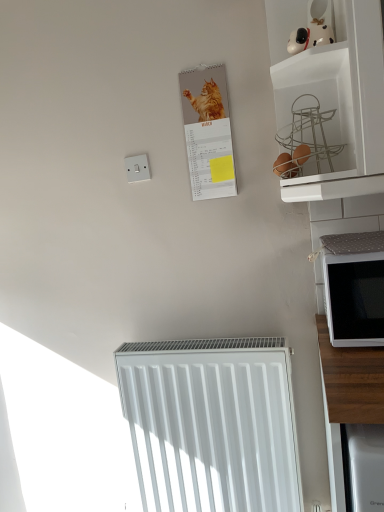
Where is `matte paper calendar at upper center`? matte paper calendar at upper center is located at coordinates (208, 132).

Where is `matte paper calendar at upper center`? This screenshot has height=512, width=384. matte paper calendar at upper center is located at coordinates (208, 132).

Is white matte wire basket at upper right smaller than matte paper calendar at upper center?

Actually, white matte wire basket at upper right might be larger than matte paper calendar at upper center.

Locate an element on the screen. Image resolution: width=384 pixels, height=512 pixels. bulletin board lying below the white matte wire basket at upper right (from the image's perspective) is located at coordinates (208, 132).

Can you tell me how much white matte wire basket at upper right and matte paper calendar at upper center differ in facing direction?

0.103 degrees separate the facing orientations of white matte wire basket at upper right and matte paper calendar at upper center.

Looking at this image, considering the relative positions of white matte wire basket at upper right and matte paper calendar at upper center in the image provided, is white matte wire basket at upper right to the left or to the right of matte paper calendar at upper center?

Based on their positions, white matte wire basket at upper right is located to the right of matte paper calendar at upper center.

Is white matte wire basket at upper right next to white matte microwave at right and touching it?

No, white matte wire basket at upper right is not next to white matte microwave at right.

Considering the positions of objects white matte wire basket at upper right and white matte microwave at right in the image provided, who is behind, white matte wire basket at upper right or white matte microwave at right?

white matte microwave at right is more distant.

Does white matte wire basket at upper right turn towards white matte microwave at right?

No, white matte wire basket at upper right is not facing towards white matte microwave at right.

Which object is wider, white matte wire basket at upper right or white matte microwave at right?

Wider between the two is white matte wire basket at upper right.

Is white matte wire basket at upper right to the left of white plastic switch at upper left from the viewer's perspective?

In fact, white matte wire basket at upper right is to the right of white plastic switch at upper left.

At what (x,y) coordinates should I click in order to perform the action: click on electric outlet that is on the left side of white matte wire basket at upper right. Please return your answer as a coordinate pair (x, y). The width and height of the screenshot is (384, 512). Looking at the image, I should click on (137, 168).

From the image's perspective, would you say white matte wire basket at upper right is shown under white plastic switch at upper left?

No, from the image's perspective, white matte wire basket at upper right is not beneath white plastic switch at upper left.

Is white matte microwave at right aimed at white smooth radiator at lower center?

No.

Is point (357, 283) positioned before point (199, 362)?

Yes, it is in front of point (199, 362).

In the image, is matte paper calendar at upper center positioned in front of or behind white plastic switch at upper left?

Clearly, matte paper calendar at upper center is in front of white plastic switch at upper left.

In terms of width, does matte paper calendar at upper center look wider or thinner when compared to white plastic switch at upper left?

Clearly, matte paper calendar at upper center has more width compared to white plastic switch at upper left.

Is matte paper calendar at upper center in contact with white plastic switch at upper left?

No, matte paper calendar at upper center is not with white plastic switch at upper left.

From a real-world perspective, which is physically below, matte paper calendar at upper center or white plastic switch at upper left?

→ In real-world perspective, white plastic switch at upper left is lower.

Looking at this image, from the image's perspective, is white smooth radiator at lower center under white matte wire basket at upper right?

Indeed, from the image's perspective, white smooth radiator at lower center is shown beneath white matte wire basket at upper right.

Relative to white matte wire basket at upper right, is white smooth radiator at lower center in front or behind?

white smooth radiator at lower center is positioned farther from the viewer than white matte wire basket at upper right.

Would you say white smooth radiator at lower center is outside white matte wire basket at upper right?

Yes, white smooth radiator at lower center is outside of white matte wire basket at upper right.

Between white plastic switch at upper left and white matte microwave at right, which one has larger width?

With larger width is white matte microwave at right.

From the image's perspective, between white plastic switch at upper left and white matte microwave at right, who is located below?

white matte microwave at right, from the image's perspective.

At what (x,y) coordinates should I click in order to perform the action: click on microwave oven in front of the white plastic switch at upper left. Please return your answer as a coordinate pair (x, y). Looking at the image, I should click on (354, 288).

Based on the photo, which object is positioned more to the right, white plastic switch at upper left or white matte microwave at right?

→ Positioned to the right is white matte microwave at right.

I want to click on shelf on the right side of matte paper calendar at upper center, so click(x=333, y=98).

Locate an element on the screen. The image size is (384, 512). shelf above the white matte microwave at right (from a real-world perspective) is located at coordinates (333, 98).

When comparing their distances from white matte microwave at right, does white smooth radiator at lower center or matte paper calendar at upper center seem closer?

The object closer to white matte microwave at right is matte paper calendar at upper center.

Considering their positions, is white matte microwave at right positioned closer to white plastic switch at upper left than matte paper calendar at upper center?

matte paper calendar at upper center is positioned closer to the anchor white plastic switch at upper left.

Based on their spatial positions, is white matte wire basket at upper right or white plastic switch at upper left further from white smooth radiator at lower center?

white plastic switch at upper left is further to white smooth radiator at lower center.

Looking at the image, which one is located closer to matte paper calendar at upper center, white smooth radiator at lower center or white matte wire basket at upper right?

white matte wire basket at upper right lies closer to matte paper calendar at upper center than the other object.

Looking at the image, which one is located further to white matte microwave at right, white smooth radiator at lower center or white matte wire basket at upper right?

white smooth radiator at lower center.

From the image, which object appears to be nearer to white matte microwave at right, white matte wire basket at upper right or white plastic switch at upper left?

white matte wire basket at upper right lies closer to white matte microwave at right than the other object.

Looking at the image, which one is located further to white plastic switch at upper left, white matte microwave at right or white matte wire basket at upper right?

white matte microwave at right lies further to white plastic switch at upper left than the other object.

Estimate the real-world distances between objects in this image. Which object is further from white smooth radiator at lower center, matte paper calendar at upper center or white matte microwave at right?

Based on the image, matte paper calendar at upper center appears to be further to white smooth radiator at lower center.

You are a GUI agent. You are given a task and a screenshot of the screen. Output one action in this format:
    pyautogui.click(x=<x>, y=<y>)
    Task: Click on the bulletin board between white matte wire basket at upper right and white smooth radiator at lower center vertically
    
    Given the screenshot: What is the action you would take?
    coord(208,132)

This screenshot has height=512, width=384. I want to click on bulletin board between white plastic switch at upper left and white matte microwave at right from left to right, so click(x=208, y=132).

Where is `bulletin board located between white matte wire basket at upper right and white plastic switch at upper left in the depth direction`? The image size is (384, 512). bulletin board located between white matte wire basket at upper right and white plastic switch at upper left in the depth direction is located at coordinates (208, 132).

Identify the location of bulletin board between white matte wire basket at upper right and white matte microwave at right from top to bottom. (208, 132).